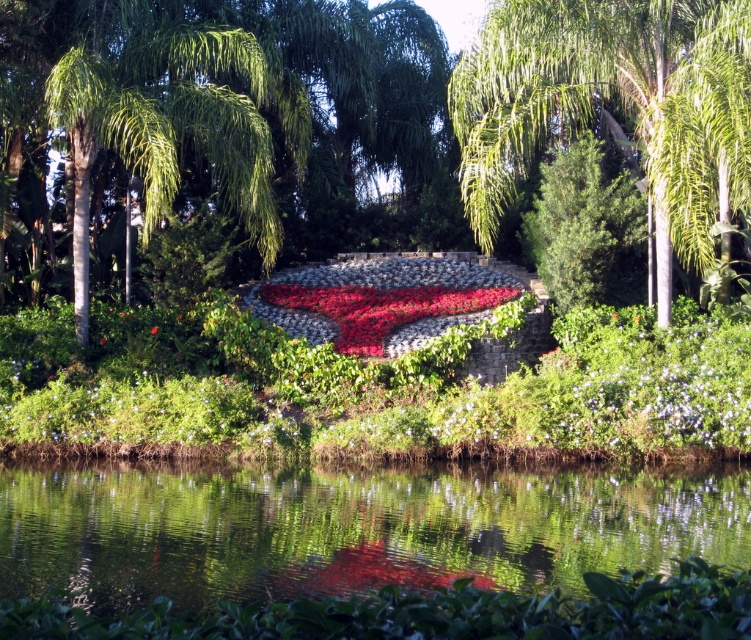
You are a gardener planning to install a new sprinkler system. You need to ensure that both the green reflective water at center and the green leafy palm tree at center are watered efficiently. Considering their sizes, which object requires a larger water sprinkler coverage area?

The green leafy palm tree at center requires a larger water sprinkler coverage area because it is bigger than the green reflective water at center.

You are standing in the garden and want to reach the point marked at coordinates (659,42). If your walking distance is limited to 20 meters, will you be able to reach that point?

The point marked at coordinates (659,42) is 20.97 meters away from you, which exceeds your 20 meter limit, so you cannot reach it.

You are a gardener who needs to place a new decorative statue that is 3 meters wide between the green reflective water at center and the green leafy palm tree at center. Can the statue fit in the space between them without overlapping either object?

The distance between the green reflective water at center and the green leafy palm tree at center is 7.04 meters. Since the statue is 3 meters wide, it can fit in the space between them as 3 meters is less than 7.04 meters, allowing enough room without overlapping either object.